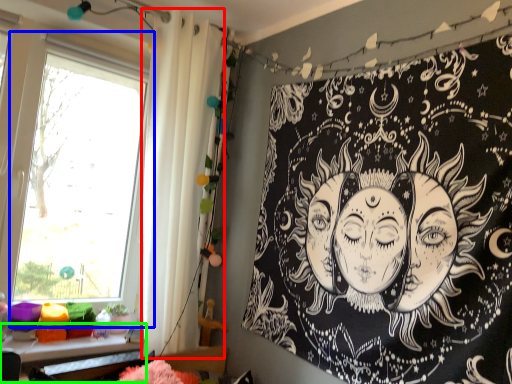
Question: Estimate the real-world distances between objects in this image. Which object is closer to shower curtain (highlighted by a red box), window (highlighted by a blue box) or table (highlighted by a green box)?

Choices:
 (A) window
 (B) table

Answer: (B)